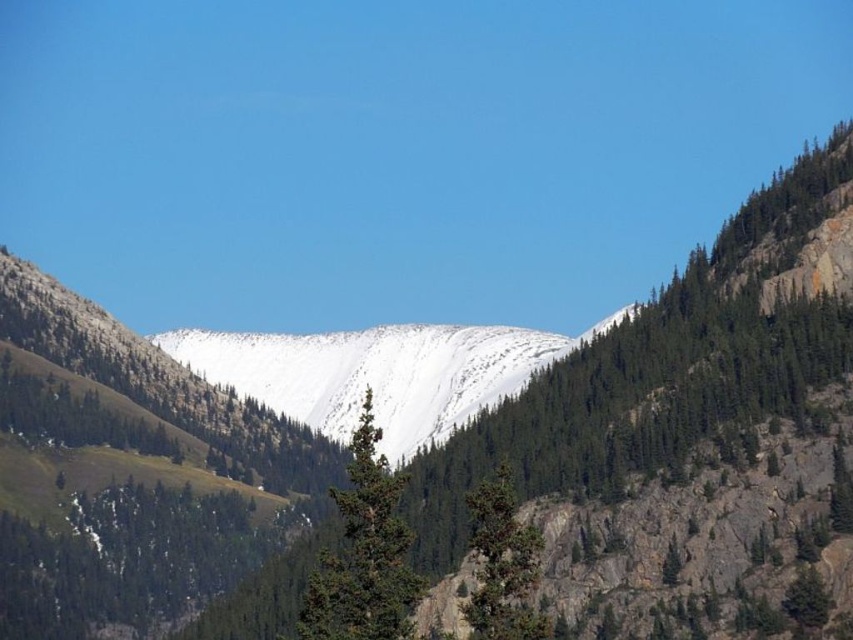
Is white matte snow at center shorter than green textured tree at center?

Incorrect, white matte snow at center's height does not fall short of green textured tree at center's.

Is point (280, 364) farther from viewer compared to point (358, 524)?

Yes, it is behind point (358, 524).

The height and width of the screenshot is (640, 853). I want to click on white matte snow at center, so click(373, 372).

From the picture: Can you confirm if white matte snow at center is bigger than green rough bark tree at center?

Indeed, white matte snow at center has a larger size compared to green rough bark tree at center.

Is point (200, 339) positioned before point (505, 515)?

No, it is not.

Which is behind, point (152, 340) or point (514, 544)?

Positioned behind is point (152, 340).

Where is `white matte snow at center`? white matte snow at center is located at coordinates (373, 372).

In the scene shown: Does green textured tree at center lie behind green rough bark tree at center?

No, it is not.

Is point (339, 573) in front of point (485, 484)?

Yes, it is.

The image size is (853, 640). Describe the element at coordinates (364, 554) in the screenshot. I see `green textured tree at center` at that location.

I want to click on green textured tree at center, so click(x=364, y=554).